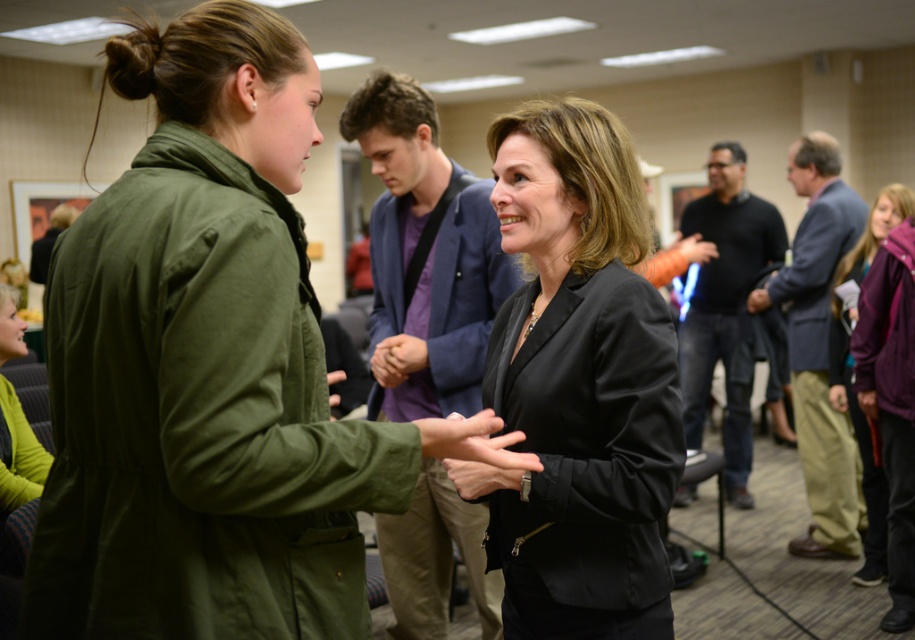
You are an interior designer assessing the layout of this conference room. You notice the blue fabric jacket at center and the gray wool suit at right. Which of these two items has a shorter length?

The blue fabric jacket at center is shorter than the gray wool suit at right.

You are standing in the conference room and need to hand a document to the person wearing the gray wool suit at right. Which direction should you move to approach them from the blue fabric jacket at center?

The blue fabric jacket at center is closer to the viewer than the gray wool suit at right, so you should move towards the right direction to approach the gray wool suit at right from the blue fabric jacket at center.

You are a person who is 5 feet tall standing in the conference room. You want to walk from the blue fabric jacket at center to the purple fleece jacket at lower right. Can you comfortably walk this path without needing to move any furniture?

The distance between the blue fabric jacket at center and the purple fleece jacket at lower right is 6.53 feet, which is more than enough space for a 5 feet tall person to walk comfortably without needing to move any furniture.